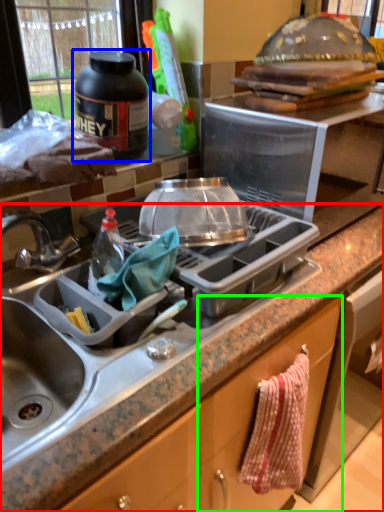
Question: Based on their relative distances, which object is nearer to countertop (highlighted by a red box)? Choose from bottle (highlighted by a blue box) and cabinetry (highlighted by a green box).

Choices:
 (A) bottle
 (B) cabinetry

Answer: (B)